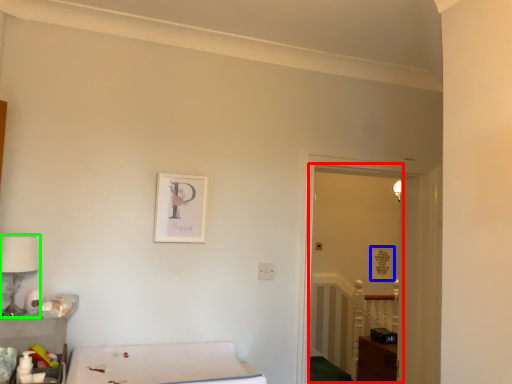
Question: Based on their relative distances, which object is nearer to glass door (highlighted by a red box)? Choose from picture frame (highlighted by a blue box) and table lamp (highlighted by a green box).

Choices:
 (A) picture frame
 (B) table lamp

Answer: (A)